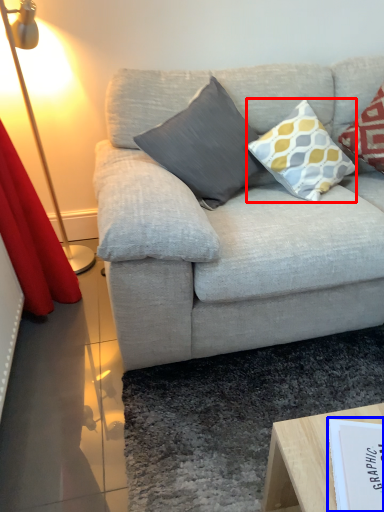
Question: Which point is closer to the camera, pillow (highlighted by a red box) or paperback book (highlighted by a blue box)?

Choices:
 (A) pillow
 (B) paperback book

Answer: (B)